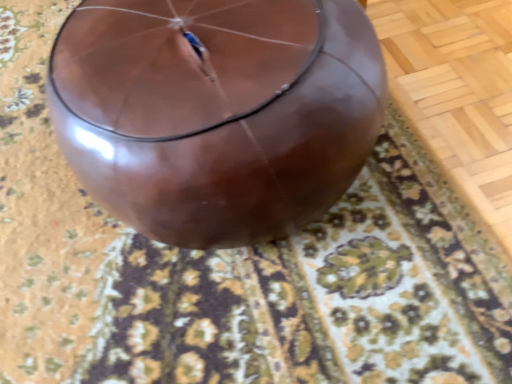
Question: Is point (82, 157) positioned closer to the camera than point (364, 334)?

Choices:
 (A) farther
 (B) closer

Answer: (B)

Question: From the image's perspective, relative to brown glossy mat at center, is glossy brown balloon at center above or below?

Choices:
 (A) above
 (B) below

Answer: (B)

Question: In terms of size, does glossy brown balloon at center appear bigger or smaller than brown glossy mat at center?

Choices:
 (A) big
 (B) small

Answer: (A)

Question: From a real-world perspective, is brown glossy mat at center above or below glossy brown balloon at center?

Choices:
 (A) below
 (B) above

Answer: (A)

Question: Is brown glossy mat at center wider or thinner than glossy brown balloon at center?

Choices:
 (A) wide
 (B) thin

Answer: (A)

Question: Relative to glossy brown balloon at center, is brown glossy mat at center in front or behind?

Choices:
 (A) behind
 (B) front

Answer: (A)

Question: Choose the correct answer: Is brown glossy mat at center inside glossy brown balloon at center or outside it?

Choices:
 (A) inside
 (B) outside

Answer: (B)